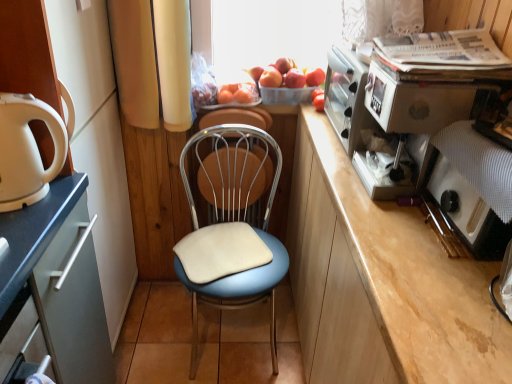
Question: Is smooth red apple at center, which is counted as the 2th apple, starting from the right, positioned in front of red matte apple at upper center, placed as the second apple when sorted from left to right?

Choices:
 (A) no
 (B) yes

Answer: (A)

Question: From a real-world perspective, is smooth red apple at center, which is counted as the 2th apple, starting from the right, physically below red matte apple at upper center, placed as the second apple when sorted from left to right?

Choices:
 (A) yes
 (B) no

Answer: (A)

Question: Are smooth red apple at center, acting as the first apple starting from the left, and red matte apple at upper center, which ranks as the 1th apple in right-to-left order, beside each other?

Choices:
 (A) no
 (B) yes

Answer: (B)

Question: Does smooth red apple at center, which is counted as the 2th apple, starting from the right, have a smaller size compared to red matte apple at upper center, placed as the second apple when sorted from left to right?

Choices:
 (A) yes
 (B) no

Answer: (B)

Question: Does smooth red apple at center, acting as the first apple starting from the left, lie behind red matte apple at upper center, placed as the second apple when sorted from left to right?

Choices:
 (A) yes
 (B) no

Answer: (A)

Question: From the image's perspective, is smooth red apple at center, which is counted as the 2th apple, starting from the right, positioned above or below matte white cabinet at left?

Choices:
 (A) below
 (B) above

Answer: (B)

Question: In terms of size, does smooth red apple at center, which is counted as the 2th apple, starting from the right, appear bigger or smaller than matte white cabinet at left?

Choices:
 (A) small
 (B) big

Answer: (A)

Question: From a real-world perspective, is smooth red apple at center, which is counted as the 2th apple, starting from the right, above or below matte white cabinet at left?

Choices:
 (A) below
 (B) above

Answer: (B)

Question: Is point 269,67 closer or farther from the camera than point 82,104?

Choices:
 (A) farther
 (B) closer

Answer: (A)

Question: From the image's perspective, is matte white cabinet at left positioned above or below red matte apple at upper center, which ranks as the 1th apple in right-to-left order?

Choices:
 (A) below
 (B) above

Answer: (A)

Question: Considering their positions, is matte white cabinet at left located in front of or behind red matte apple at upper center, which ranks as the 1th apple in right-to-left order?

Choices:
 (A) behind
 (B) front

Answer: (B)

Question: Visually, is matte white cabinet at left positioned to the left or to the right of red matte apple at upper center, placed as the second apple when sorted from left to right?

Choices:
 (A) right
 (B) left

Answer: (B)

Question: From a real-world perspective, is matte white cabinet at left above or below red matte apple at upper center, placed as the second apple when sorted from left to right?

Choices:
 (A) above
 (B) below

Answer: (B)

Question: Is red matte apple at upper center, placed as the second apple when sorted from left to right, taller or shorter than metallic silver coffee machine at upper right?

Choices:
 (A) short
 (B) tall

Answer: (A)

Question: Do you think red matte apple at upper center, which ranks as the 1th apple in right-to-left order, is within metallic silver coffee machine at upper right, or outside of it?

Choices:
 (A) outside
 (B) inside

Answer: (A)